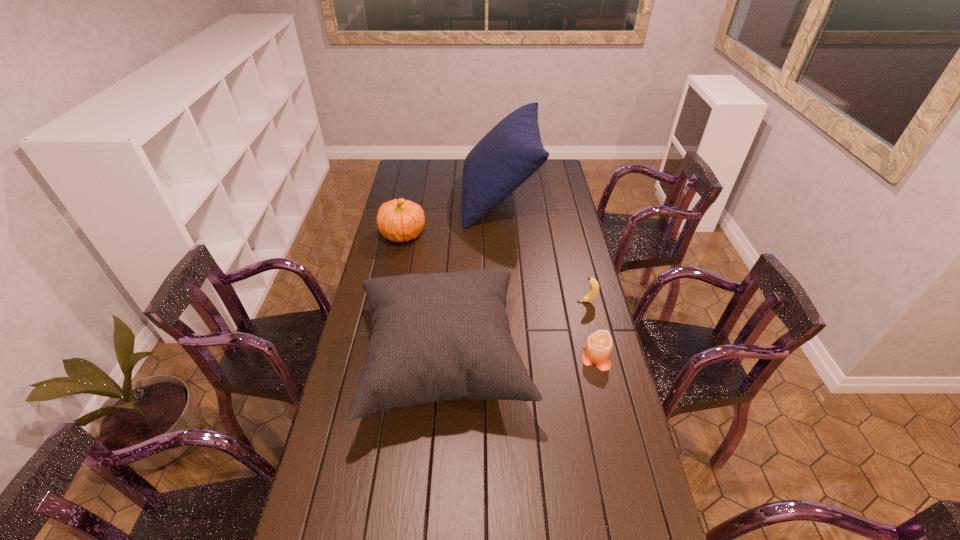
Find the location of a particular element. The height and width of the screenshot is (540, 960). free space located on the back of the second tallest object is located at coordinates (452, 247).

Locate an element on the screen. This screenshot has height=540, width=960. free space located 0.160m on the surface of the pumpkin is located at coordinates (463, 234).

At what (x,y) coordinates should I click in order to perform the action: click on blank space located from the stem of the banana. Please return your answer as a coordinate pair (x, y). The height and width of the screenshot is (540, 960). Looking at the image, I should click on (493, 302).

This screenshot has width=960, height=540. In order to click on vacant position located 0.400m from the stem of the banana in this screenshot , I will do `click(469, 302)`.

The width and height of the screenshot is (960, 540). I want to click on free space located from the stem of the banana, so click(x=516, y=302).

Locate an element on the screen. The image size is (960, 540). vacant space located 0.380m on the back of the candle is located at coordinates (575, 269).

Where is `object situated at the far edge`? This screenshot has width=960, height=540. object situated at the far edge is located at coordinates (512, 151).

The image size is (960, 540). Identify the location of cushion that is at the left edge. [x=442, y=336].

The image size is (960, 540). I want to click on pumpkin present at the left edge, so click(x=400, y=220).

Where is `cushion that is at the right edge`? The height and width of the screenshot is (540, 960). cushion that is at the right edge is located at coordinates (512, 151).